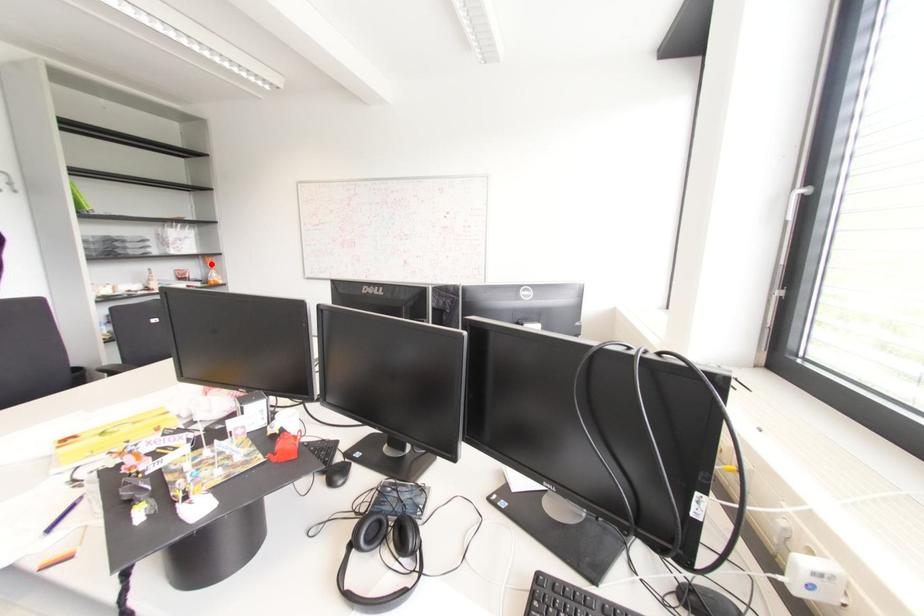
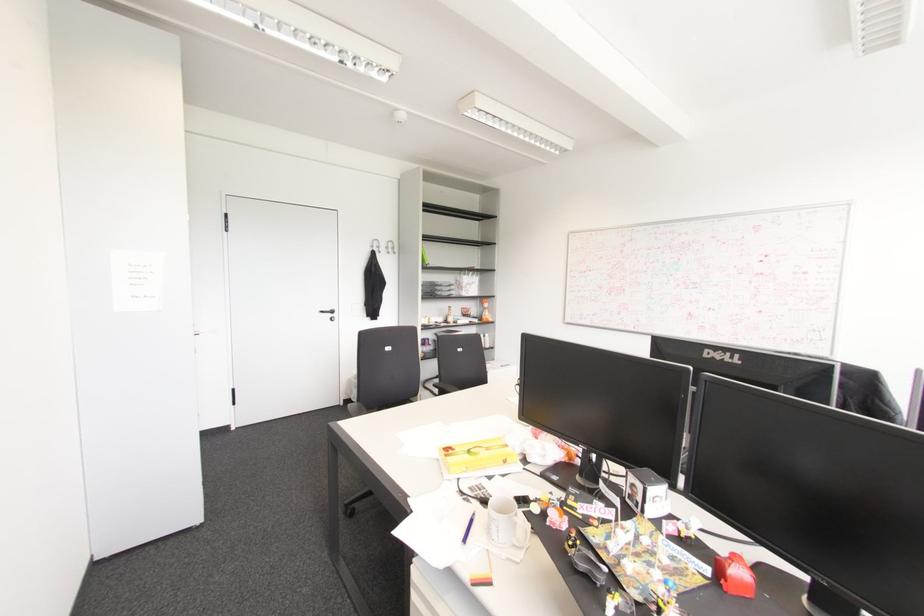
The point at the highlighted location is marked in the first image. Where is the corresponding point in the second image?

(485, 305)